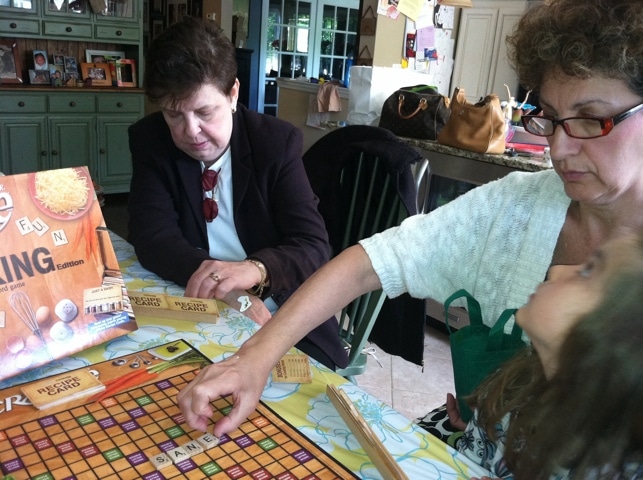
Where is `drawers`? drawers is located at coordinates click(x=32, y=105), click(x=80, y=105), click(x=125, y=107).